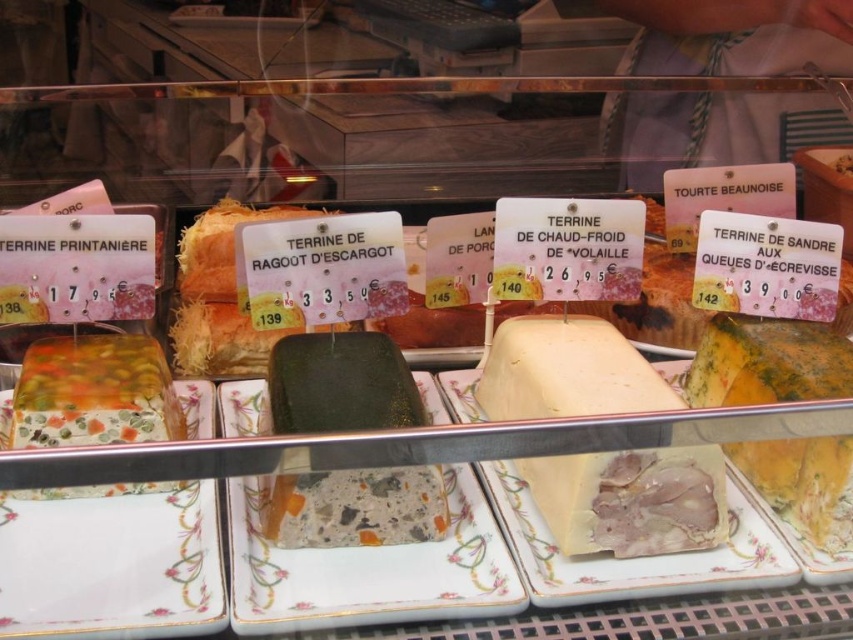
Question: Is speckled stone terrine at center to the right of yellow-green textured terrine at center from the viewer's perspective?

Choices:
 (A) yes
 (B) no

Answer: (B)

Question: Which point is closer to the camera taking this photo?

Choices:
 (A) (215, 243)
 (B) (48, 401)
 (C) (505, 572)
 (D) (15, 628)

Answer: (D)

Question: Is speckled terrine at center above yellow-green textured terrine at center?

Choices:
 (A) no
 (B) yes

Answer: (B)

Question: Which point is closer to the camera taking this photo?

Choices:
 (A) (378, 609)
 (B) (384, 525)
 (C) (659, 451)
 (D) (73, 378)

Answer: (A)

Question: Does floral-patterned ceramic platter at lower left have a greater width compared to white glossy terrine at center?

Choices:
 (A) no
 (B) yes

Answer: (A)

Question: Among these points, which one is nearest to the camera?

Choices:
 (A) (556, 552)
 (B) (79, 428)

Answer: (A)